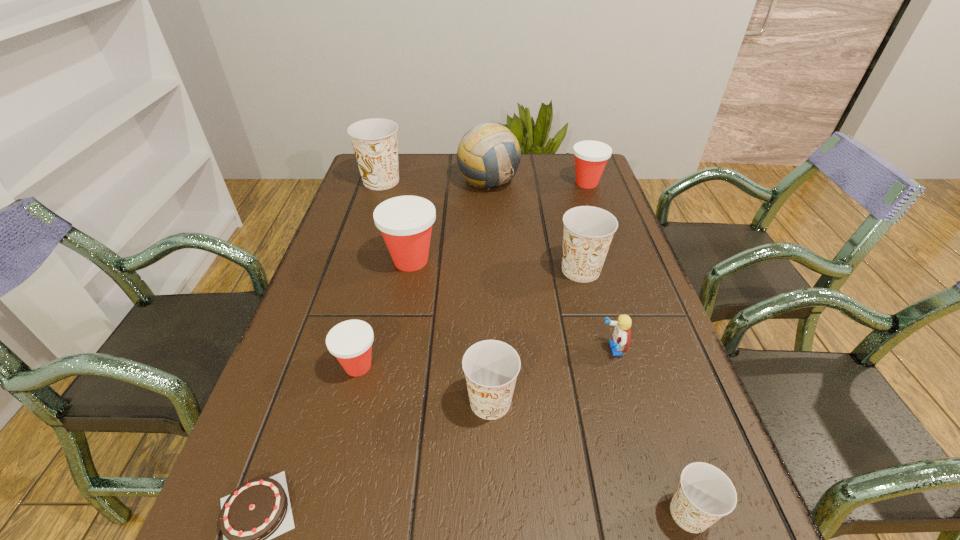
In the image, there is a desktop. Identify the location of vacant space at the right edge. (639, 307).

At what (x,y) coordinates should I click in order to perform the action: click on free region at the far left corner. Please return your answer as a coordinate pair (x, y). The height and width of the screenshot is (540, 960). Looking at the image, I should click on (362, 189).

You are a GUI agent. You are given a task and a screenshot of the screen. Output one action in this format:
    pyautogui.click(x=<x>, y=<y>)
    Task: Click on the blank space at the far right corner of the desktop
    
    Given the screenshot: What is the action you would take?
    pyautogui.click(x=549, y=156)

Locate an element on the screen. free spot between the biggest orange Dixie cup and the smallest red-orange Dixie cup is located at coordinates (370, 274).

The image size is (960, 540). Identify the location of free space between the second farthest red-orange Dixie cup and the smallest red-orange Dixie cup. (385, 313).

Locate an element on the screen. free space between the leftmost orange Dixie cup and the nearest red-orange Dixie cup is located at coordinates (370, 274).

I want to click on empty space that is in between the farthest red-orange Dixie cup and the nearest Dixie cup, so click(637, 348).

Identify the location of free area in between the nearest orange Dixie cup and the biggest red-orange Dixie cup. (550, 387).

Where is `vacant space that's between the volleyball and the second farthest orange Dixie cup`? The image size is (960, 540). vacant space that's between the volleyball and the second farthest orange Dixie cup is located at coordinates (535, 225).

Find the location of a particular element. vacant space that is in between the third smallest orange Dixie cup and the nearest red-orange Dixie cup is located at coordinates (469, 318).